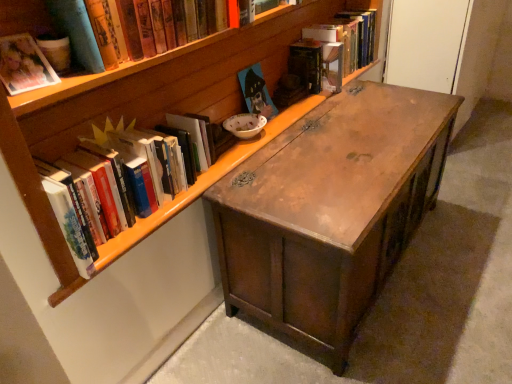
Identify the location of matte cardboard book at upper left, the first book from the front. (108, 74).

What is the approximate width of matte cardboard book at upper left, the sixth book viewed from the back?

It is 7.60 inches.

Image resolution: width=512 pixels, height=384 pixels. Find the location of `hardcover books at left, which is the third book in front-to-back order`. hardcover books at left, which is the third book in front-to-back order is located at coordinates (125, 189).

The height and width of the screenshot is (384, 512). What do you see at coordinates (342, 46) in the screenshot?
I see `hardcover book at upper center, which is the second book in back-to-front order` at bounding box center [342, 46].

This screenshot has width=512, height=384. Identify the location of hardcover book at upper right, which ranks as the 6th book in front-to-back order. (356, 38).

Image resolution: width=512 pixels, height=384 pixels. In order to click on matte wooden painting at center, the third book in the back-to-front sequence in this screenshot , I will do `click(256, 92)`.

Where is `desk on the right of the hardcover book at upper center, which is the second book in back-to-front order`? desk on the right of the hardcover book at upper center, which is the second book in back-to-front order is located at coordinates (330, 211).

Is hardcover book at upper center, which is the second book in back-to-front order, oriented towards wooden desk at center?

No, hardcover book at upper center, which is the second book in back-to-front order, is not aimed at wooden desk at center.

Which is less distant, (372, 51) or (265, 194)?

Point (372, 51) appears to be farther away from the viewer than point (265, 194).

Looking at this image, considering the relative positions of hardcover books at left, which is the third book in front-to-back order, and wooden desk at center in the image provided, is hardcover books at left, which is the third book in front-to-back order, to the left or to the right of wooden desk at center?

hardcover books at left, which is the third book in front-to-back order, is positioned on wooden desk at center's left side.

From the image's perspective, would you say hardcover books at left, the fourth book positioned from the back, is shown under wooden desk at center?

No.

Is hardcover books at left, which is the third book in front-to-back order, far away from wooden desk at center?

They are positioned close to each other.

Is hardcover books at left, the fourth book positioned from the back, thinner than wooden desk at center?

Correct, the width of hardcover books at left, the fourth book positioned from the back, is less than that of wooden desk at center.

Can you tell me how much wooden bookcase at upper center and hardcover book at upper right, which ranks as the 6th book in front-to-back order, differ in facing direction?

The angular difference between wooden bookcase at upper center and hardcover book at upper right, which ranks as the 6th book in front-to-back order, is 0.00353 degrees.

Would you say wooden bookcase at upper center is a long distance from hardcover book at upper right, which ranks as the first book in back-to-front order?

wooden bookcase at upper center is near hardcover book at upper right, which ranks as the first book in back-to-front order, not far away.

From a real-world perspective, who is located lower, wooden bookcase at upper center or hardcover book at upper right, which ranks as the 6th book in front-to-back order?

hardcover book at upper right, which ranks as the 6th book in front-to-back order, from a real-world perspective.

Locate an element on the screen. bookcase that is below the hardcover book at upper right, which ranks as the first book in back-to-front order (from the image's perspective) is located at coordinates (142, 107).

From the image's perspective, between matte wooden painting at center, the third book in the back-to-front sequence, and matte cardboard book at upper left, the first book from the front, who is located below?

matte wooden painting at center, the third book in the back-to-front sequence.

Considering the sizes of objects matte wooden painting at center, the third book in the back-to-front sequence, and matte cardboard book at upper left, the first book from the front, in the image provided, who is shorter, matte wooden painting at center, the third book in the back-to-front sequence, or matte cardboard book at upper left, the first book from the front,?

With less height is matte cardboard book at upper left, the first book from the front.

From a real-world perspective, is matte wooden painting at center, the third book in the back-to-front sequence, positioned above or below matte cardboard book at upper left, the first book from the front?

Clearly, from a real-world perspective, matte wooden painting at center, the third book in the back-to-front sequence, is below matte cardboard book at upper left, the first book from the front.

Considering the positions of objects matte wooden painting at center, the third book in the back-to-front sequence, and matte cardboard book at upper left, the sixth book viewed from the back, in the image provided, who is more to the right, matte wooden painting at center, the third book in the back-to-front sequence, or matte cardboard book at upper left, the sixth book viewed from the back,?

Positioned to the right is matte wooden painting at center, the third book in the back-to-front sequence.

Between hardcover book at upper right, which ranks as the 6th book in front-to-back order, and hardcover book at upper center, which is the 5th book from front to back, which one has larger width?

hardcover book at upper center, which is the 5th book from front to back, is wider.

Can you confirm if hardcover book at upper right, which ranks as the 6th book in front-to-back order, is shorter than hardcover book at upper center, which is the second book in back-to-front order?

No.

Considering the sizes of objects hardcover book at upper right, which ranks as the 6th book in front-to-back order, and hardcover book at upper center, which is the 5th book from front to back, in the image provided, who is bigger, hardcover book at upper right, which ranks as the 6th book in front-to-back order, or hardcover book at upper center, which is the 5th book from front to back,?

hardcover book at upper right, which ranks as the 6th book in front-to-back order, is bigger.

Is hardcover book at upper right, which ranks as the 6th book in front-to-back order, facing away from hardcover book at upper center, which is the second book in back-to-front order?

No, hardcover book at upper right, which ranks as the 6th book in front-to-back order,'s orientation is not away from hardcover book at upper center, which is the second book in back-to-front order.

Can you tell me how much hardcover book at upper center, which is the 5th book from front to back, and hardcover book at upper right, which ranks as the 6th book in front-to-back order, differ in facing direction?

There is a 0.0035-degree angle between the facing directions of hardcover book at upper center, which is the 5th book from front to back, and hardcover book at upper right, which ranks as the 6th book in front-to-back order.

Is the depth of hardcover book at upper center, which is the 5th book from front to back, less than that of hardcover book at upper right, which ranks as the 6th book in front-to-back order?

Yes, the depth of hardcover book at upper center, which is the 5th book from front to back, is less than that of hardcover book at upper right, which ranks as the 6th book in front-to-back order.

Consider the image. Can you confirm if hardcover book at upper center, which is the 5th book from front to back, is smaller than hardcover book at upper right, which ranks as the first book in back-to-front order?

Yes.

Locate an element on the screen. The height and width of the screenshot is (384, 512). book lying above the hardcover book at upper center, which is the second book in back-to-front order (from the image's perspective) is located at coordinates (356, 38).

Is hardcover book at upper right, which ranks as the first book in back-to-front order, aimed at wooden desk at center?

No, hardcover book at upper right, which ranks as the first book in back-to-front order, does not turn towards wooden desk at center.

From a real-world perspective, is hardcover book at upper right, which ranks as the 6th book in front-to-back order, positioned above or below wooden desk at center?

hardcover book at upper right, which ranks as the 6th book in front-to-back order, is above wooden desk at center.

Is hardcover book at upper right, which ranks as the first book in back-to-front order, bigger than wooden desk at center?

Incorrect, hardcover book at upper right, which ranks as the first book in back-to-front order, is not larger than wooden desk at center.

Who is taller, hardcover book at upper right, which ranks as the 6th book in front-to-back order, or wooden desk at center?

Standing taller between the two is wooden desk at center.

You are a GUI agent. You are given a task and a screenshot of the screen. Output one action in this format:
    pyautogui.click(x=<x>, y=<y>)
    Task: Click on the desk in front of the hardcover book at upper center, which is the 5th book from front to back
    The width and height of the screenshot is (512, 384).
    Given the screenshot: What is the action you would take?
    pyautogui.click(x=330, y=211)

Which book is the 4th one when counting from the left side of the wooden desk at center? Please provide its 2D coordinates.

[(125, 189)]

From the image, which object appears to be nearer to matte cardboard book at upper left, the sixth book viewed from the back, matte paper photo album at upper left, the second book positioned from the front, or wooden bookcase at upper center?

The object closer to matte cardboard book at upper left, the sixth book viewed from the back, is wooden bookcase at upper center.

When comparing their distances from wooden desk at center, does wooden bookcase at upper center or matte wooden painting at center, the third book in the back-to-front sequence, seem further?

→ matte wooden painting at center, the third book in the back-to-front sequence.

From the picture: From the image, which object appears to be farther from hardcover book at upper right, which ranks as the 6th book in front-to-back order, hardcover book at upper center, which is the 5th book from front to back, or hardcover books at left, the fourth book positioned from the back?

hardcover books at left, the fourth book positioned from the back, lies further to hardcover book at upper right, which ranks as the 6th book in front-to-back order, than the other object.

Which object lies nearer to the anchor point wooden desk at center, matte paper photo album at upper left, which is the fifth book from back to front, or hardcover book at upper right, which ranks as the first book in back-to-front order?

hardcover book at upper right, which ranks as the first book in back-to-front order, is closer to wooden desk at center.

When comparing their distances from hardcover book at upper right, which ranks as the 6th book in front-to-back order, does wooden desk at center or hardcover book at upper center, which is the second book in back-to-front order, seem closer?

Among the two, hardcover book at upper center, which is the second book in back-to-front order, is located nearer to hardcover book at upper right, which ranks as the 6th book in front-to-back order.

Based on their spatial positions, is hardcover book at upper center, which is the second book in back-to-front order, or hardcover book at upper right, which ranks as the first book in back-to-front order, further from matte paper photo album at upper left, the second book positioned from the front?

The object further to matte paper photo album at upper left, the second book positioned from the front, is hardcover book at upper right, which ranks as the first book in back-to-front order.

From the image, which object appears to be nearer to hardcover books at left, which is the third book in front-to-back order, wooden desk at center or matte paper photo album at upper left, the second book positioned from the front?

matte paper photo album at upper left, the second book positioned from the front, is positioned closer to the anchor hardcover books at left, which is the third book in front-to-back order.

Looking at the image, which one is located closer to matte wooden painting at center, the third book in the back-to-front sequence, wooden desk at center or matte cardboard book at upper left, the sixth book viewed from the back?

Among the two, matte cardboard book at upper left, the sixth book viewed from the back, is located nearer to matte wooden painting at center, the third book in the back-to-front sequence.

I want to click on desk between matte cardboard book at upper left, the first book from the front, and hardcover book at upper right, which ranks as the first book in back-to-front order, from front to back, so click(x=330, y=211).

This screenshot has width=512, height=384. I want to click on book located between matte paper photo album at upper left, the second book positioned from the front, and matte wooden painting at center, the third book in the back-to-front sequence, in the depth direction, so click(125, 189).

At what (x,y) coordinates should I click in order to perform the action: click on desk between hardcover books at left, which is the third book in front-to-back order, and hardcover book at upper center, which is the second book in back-to-front order, from front to back. Please return your answer as a coordinate pair (x, y). Looking at the image, I should click on (330, 211).

The image size is (512, 384). Identify the location of bookcase located between hardcover books at left, which is the third book in front-to-back order, and wooden desk at center in the left-right direction. (142, 107).